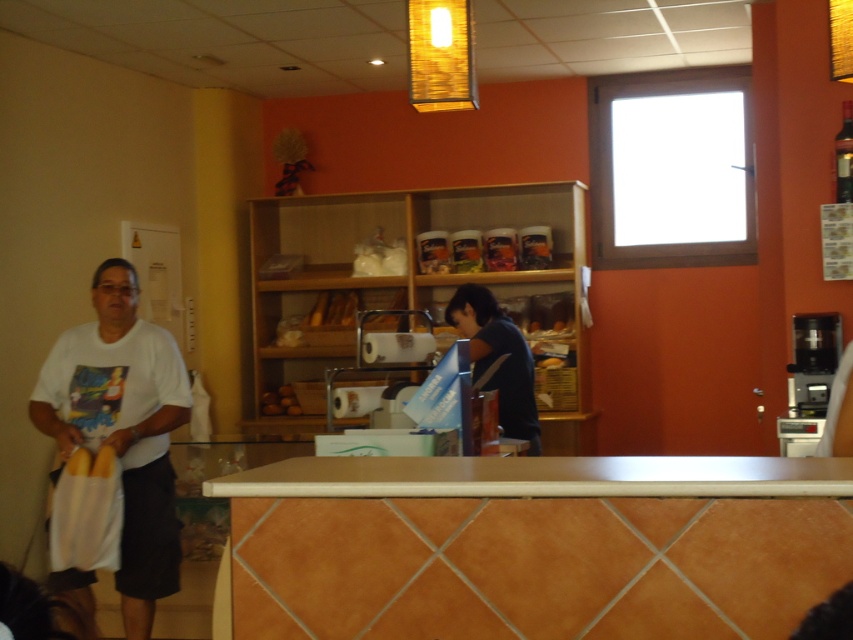
Question: Can you confirm if light brown wood counter top at center is wider than dark blue shirt at center?

Choices:
 (A) no
 (B) yes

Answer: (B)

Question: Is smooth beige counter at center positioned at the back of dark blue shirt at center?

Choices:
 (A) no
 (B) yes

Answer: (A)

Question: Which object appears closest to the camera in this image?

Choices:
 (A) white cotton shirt at left
 (B) smooth beige counter at center
 (C) dark blue shirt at center

Answer: (B)

Question: Does white cotton shirt at left come in front of dark blue shirt at center?

Choices:
 (A) yes
 (B) no

Answer: (A)

Question: Based on their relative distances, which object is nearer to the light brown wood counter top at center?

Choices:
 (A) dark blue shirt at center
 (B) smooth beige counter at center
 (C) white cotton shirt at left

Answer: (B)

Question: Which of the following is the farthest from the observer?

Choices:
 (A) dark blue shirt at center
 (B) white cotton shirt at left
 (C) light brown wood counter top at center

Answer: (A)